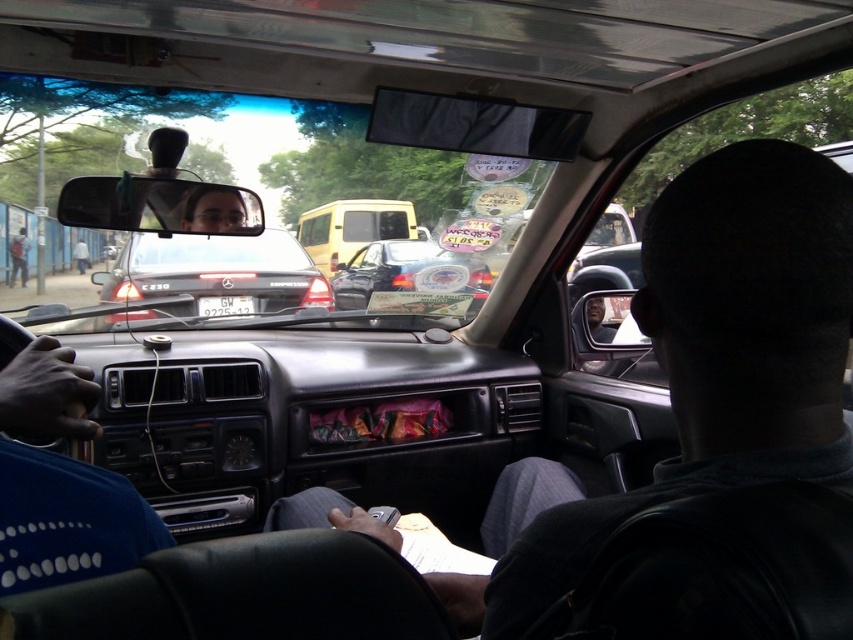
Can you confirm if shiny black car at center is smaller than matte black car door at center?

No, shiny black car at center is not smaller than matte black car door at center.

Does point (363, 289) lie behind point (595, 301)?

Yes, it is.

Locate an element on the screen. shiny black car at center is located at coordinates (409, 273).

Is point (229, 296) positioned in front of point (590, 323)?

No, it is behind (590, 323).

Does white plastic license plate at center have a lesser height compared to matte black car door at center?

Yes.

Does point (241, 301) come in front of point (601, 333)?

No, it is behind (601, 333).

I want to click on white plastic license plate at center, so click(225, 305).

From the picture: Which is more to the left, matte black car door at center or blue shirt at left?

Positioned to the left is blue shirt at left.

Does matte black car door at center have a larger size compared to blue shirt at left?

Actually, matte black car door at center might be smaller than blue shirt at left.

Describe the element at coordinates (598, 321) in the screenshot. I see `matte black car door at center` at that location.

Identify the location of matte black car door at center. (598, 321).